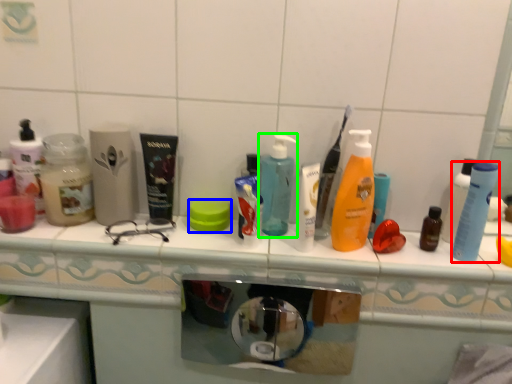
Question: Which object is positioned closest to cleaning product (highlighted by a red box)? Select from soap (highlighted by a blue box) and bottle (highlighted by a green box).

Choices:
 (A) soap
 (B) bottle

Answer: (B)